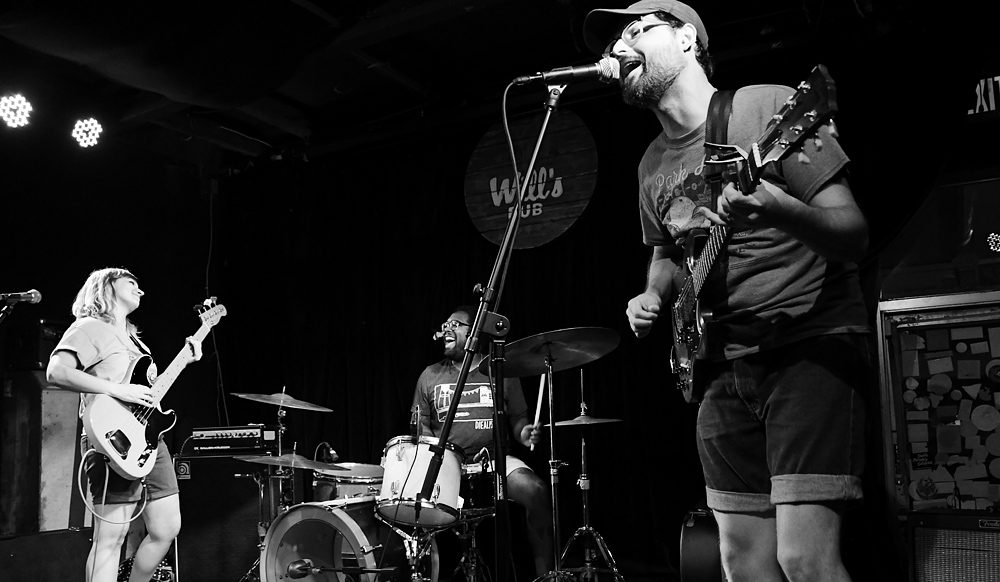
In order to click on lights in this screenshot , I will do `click(103, 122)`, `click(15, 123)`.